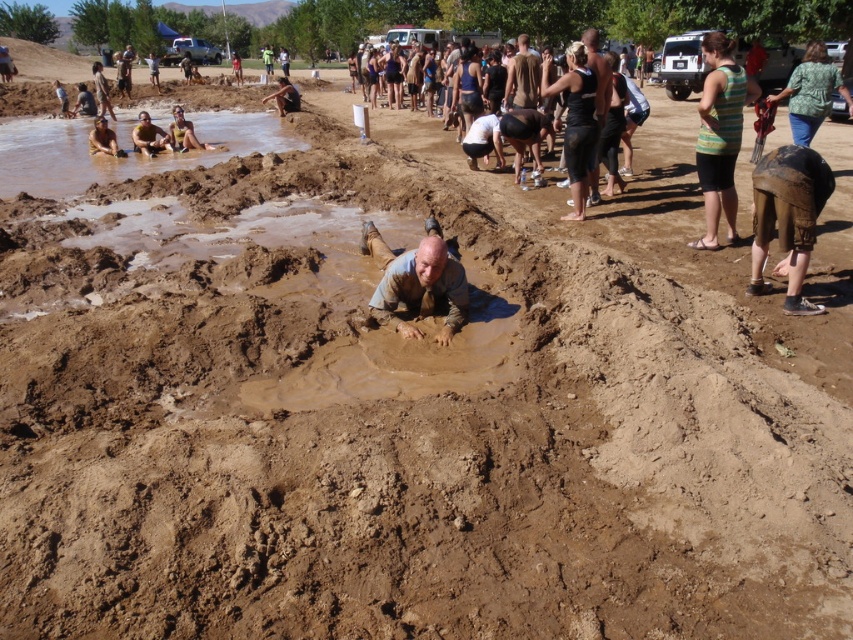
Is brown muddy water at upper left above green striped tank top at right?

Yes.

Between brown muddy water at upper left and green striped tank top at right, which one is positioned higher?

brown muddy water at upper left is above.

Is point (4, 125) more distant than point (712, 65)?

Yes, it is behind point (712, 65).

Identify the location of brown muddy water at upper left. This screenshot has width=853, height=640. (120, 147).

Does brown leather shorts at lower left appear over tan skin person at upper left?

No, brown leather shorts at lower left is not above tan skin person at upper left.

Does brown leather shorts at lower left have a lesser height compared to tan skin person at upper left?

No, brown leather shorts at lower left is not shorter than tan skin person at upper left.

Is point (142, 132) farther from camera compared to point (183, 141)?

Yes, point (142, 132) is farther from viewer.

The width and height of the screenshot is (853, 640). Identify the location of brown leather shorts at lower left. (149, 136).

Looking at this image, is light brown mud at center wider than brown leather shorts at lower left?

No, light brown mud at center is not wider than brown leather shorts at lower left.

Can you confirm if light brown mud at center is shorter than brown leather shorts at lower left?

Correct, light brown mud at center is not as tall as brown leather shorts at lower left.

Find the location of a particular element. The height and width of the screenshot is (640, 853). light brown mud at center is located at coordinates (416, 284).